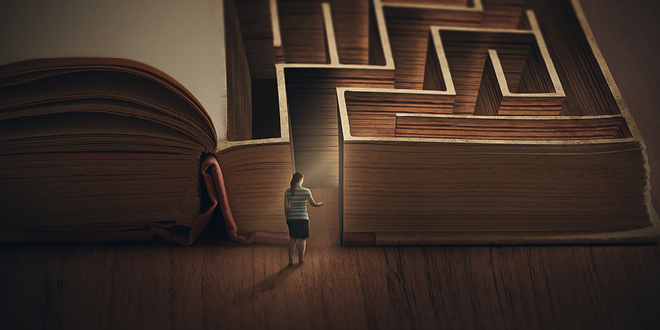
Find the location of a particular element. This screenshot has height=330, width=660. wooden floor is located at coordinates (304, 304).